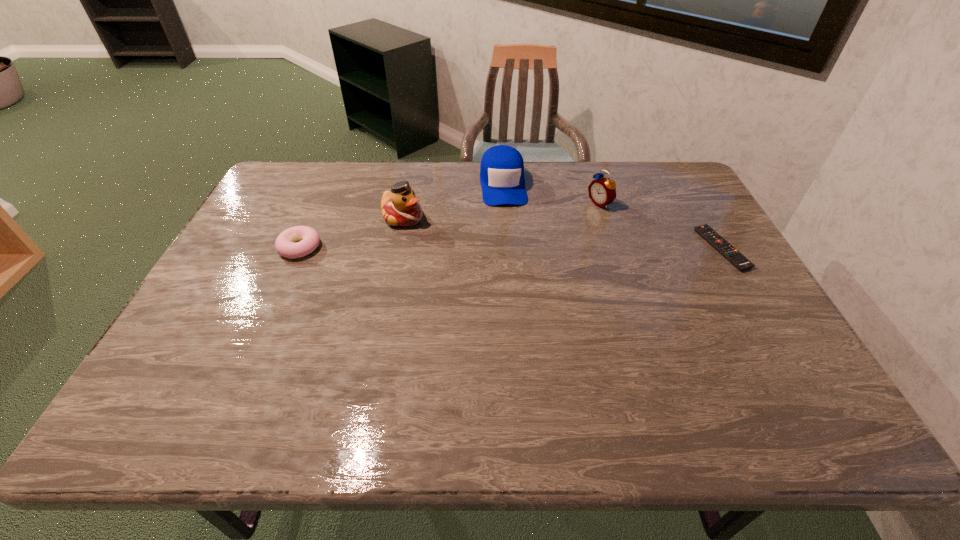
Image resolution: width=960 pixels, height=540 pixels. I want to click on free spot located 0.300m on the front-facing side of the baseball cap, so click(514, 272).

Locate an element on the screen. The width and height of the screenshot is (960, 540). vacant region located 0.260m on the front-facing side of the baseball cap is located at coordinates (513, 262).

Where is `vacant area situated on the front-facing side of the second object from right to left`? vacant area situated on the front-facing side of the second object from right to left is located at coordinates (563, 221).

Find the location of a particular element. blank area located 0.220m on the front-facing side of the second object from right to left is located at coordinates (538, 232).

At what (x,y) coordinates should I click in order to perform the action: click on vacant space located on the front-facing side of the second object from right to left. Please return your answer as a coordinate pair (x, y). This screenshot has height=540, width=960. Looking at the image, I should click on (542, 230).

In order to click on free space located 0.270m on the face of the duck in this screenshot , I will do `click(493, 257)`.

Where is `vacant space located on the face of the duck`? This screenshot has height=540, width=960. vacant space located on the face of the duck is located at coordinates (496, 258).

The image size is (960, 540). Identify the location of free space located on the face of the duck. (448, 237).

I want to click on baseball cap that is at the far edge, so click(502, 179).

At what (x,y) coordinates should I click in order to perform the action: click on alarm clock that is at the far edge. Please return your answer as a coordinate pair (x, y). Looking at the image, I should click on (602, 191).